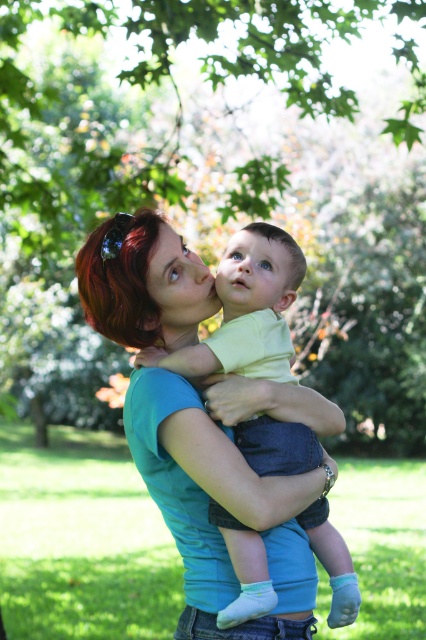
Based on the scene description, can you determine which object is taller between the green leafy tree at upper center and the light yellow fabric baby at center?

The green leafy tree at upper center is taller than the light yellow fabric baby at center according to the description.

You are a photographer trying to capture a photo of the blue smooth baby at center without any obstructions. Given the green leafy tree at upper center is above the baby, will the tree block sunlight reaching the baby?

The green leafy tree at upper center is positioned over the blue smooth baby at center, so it may block some sunlight depending on the tree density and time of day. However, the description mentions the sunlight filters through the foliage creating soft light, so partial obstruction is likely but not complete.

You are a photographer trying to capture the scene. You notice two points in the image at coordinates point (77, 182) and point (275, 288). Which point is closer to your camera?

Point (77, 182) is further to the camera than point (275, 288), so the closer point to the camera is point (275, 288).